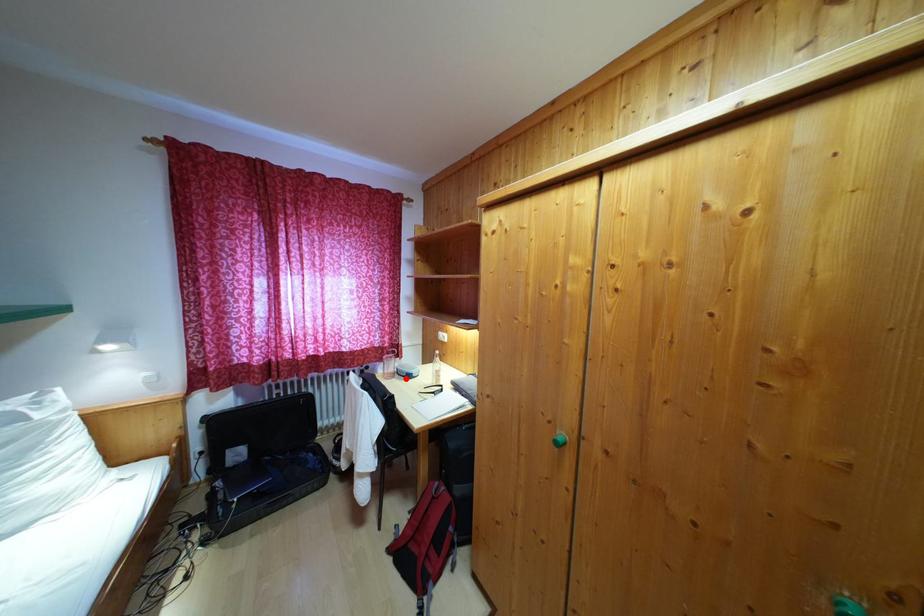
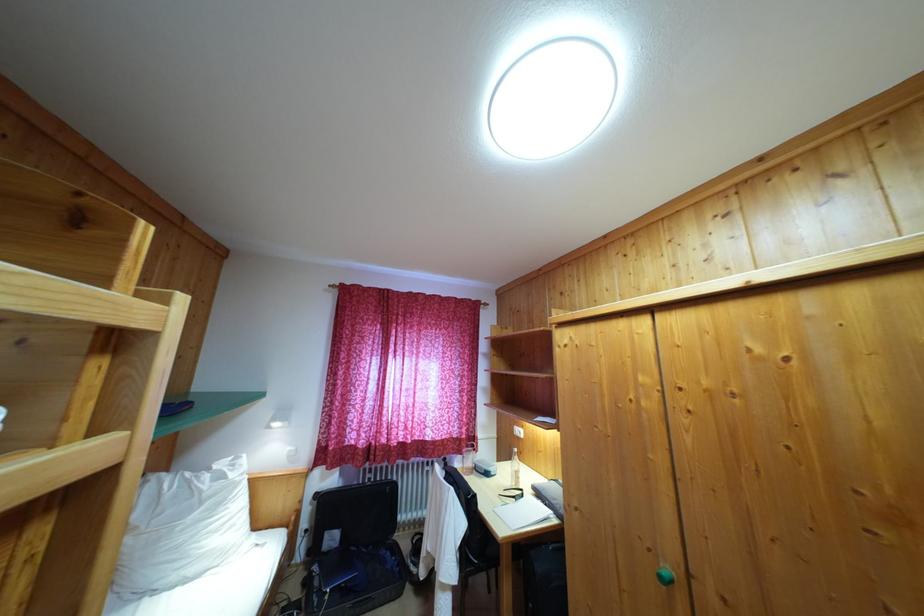
Find the pixel in the second image that matches the highlighted location in the first image.

(483, 475)